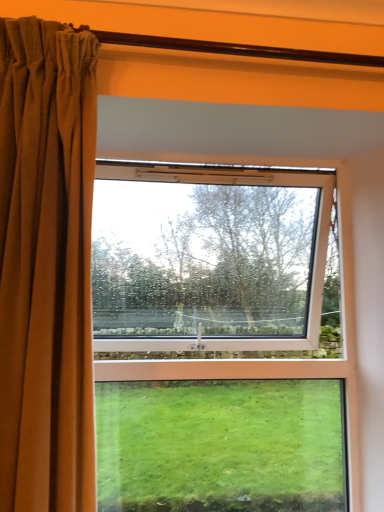
Where is `clear glass window at center`? Image resolution: width=384 pixels, height=512 pixels. clear glass window at center is located at coordinates (215, 341).

This screenshot has height=512, width=384. What do you see at coordinates (215, 341) in the screenshot? I see `clear glass window at center` at bounding box center [215, 341].

Where is `brown velvet curtain at left`? The width and height of the screenshot is (384, 512). brown velvet curtain at left is located at coordinates (46, 266).

Looking at this image, in order to face brown velvet curtain at left, should I rotate leftwards or rightwards?

Turn left approximately 18.799 degrees to face it.

Describe the element at coordinates (46, 266) in the screenshot. I see `brown velvet curtain at left` at that location.

Locate an element on the screen. The width and height of the screenshot is (384, 512). clear glass window at center is located at coordinates (215, 341).

Considering the positions of objects clear glass window at center and brown velvet curtain at left in the image provided, who is more to the left, clear glass window at center or brown velvet curtain at left?

brown velvet curtain at left is more to the left.

Is clear glass window at center closer to the viewer compared to brown velvet curtain at left?

No, it is behind brown velvet curtain at left.

Which is behind, point (270, 480) or point (8, 124)?

Positioned behind is point (270, 480).

From the image's perspective, would you say clear glass window at center is shown under brown velvet curtain at left?

Yes, from the image's perspective, clear glass window at center is below brown velvet curtain at left.

From a real-world perspective, who is located higher, clear glass window at center or brown velvet curtain at left?

brown velvet curtain at left, from a real-world perspective.

Between clear glass window at center and brown velvet curtain at left, which one has smaller width?

brown velvet curtain at left is thinner.

Which of these two, clear glass window at center or brown velvet curtain at left, stands shorter?

With less height is brown velvet curtain at left.

Considering the sizes of objects clear glass window at center and brown velvet curtain at left in the image provided, who is bigger, clear glass window at center or brown velvet curtain at left?

With larger size is clear glass window at center.

Is brown velvet curtain at left surrounded by clear glass window at center?

No.

Consider the image. Is the surface of clear glass window at center in direct contact with brown velvet curtain at left?

No, clear glass window at center is not in contact with brown velvet curtain at left.

Is clear glass window at center positioned with its back to brown velvet curtain at left?

That's not correct — clear glass window at center is not looking away from brown velvet curtain at left.

How far apart are clear glass window at center and brown velvet curtain at left?

They are 3.73 meters apart.

Locate an element on the screen. The image size is (384, 512). window located below the brown velvet curtain at left (from the image's perspective) is located at coordinates (215, 341).

Based on the photo, considering the positions of objects brown velvet curtain at left and clear glass window at center in the image provided, who is more to the left, brown velvet curtain at left or clear glass window at center?

Positioned to the left is brown velvet curtain at left.

Consider the image. Who is more distant, brown velvet curtain at left or clear glass window at center?

Positioned behind is clear glass window at center.

Which point is more forward, (74, 382) or (160, 425)?

The point (74, 382) is more forward.

Based on the photo, from the image's perspective, is brown velvet curtain at left under clear glass window at center?

Actually, brown velvet curtain at left appears above clear glass window at center in the image.

From a real-world perspective, is brown velvet curtain at left under clear glass window at center?

Incorrect, from a real-world perspective, brown velvet curtain at left is higher than clear glass window at center.

Can you confirm if brown velvet curtain at left is thinner than clear glass window at center?

Yes, brown velvet curtain at left is thinner than clear glass window at center.

Considering the sizes of brown velvet curtain at left and clear glass window at center in the image, is brown velvet curtain at left taller or shorter than clear glass window at center?

Clearly, brown velvet curtain at left is shorter compared to clear glass window at center.

In the scene shown: Between brown velvet curtain at left and clear glass window at center, which one has larger size?

With larger size is clear glass window at center.

Is brown velvet curtain at left surrounding clear glass window at center?

Definitely not — clear glass window at center is not inside brown velvet curtain at left.

Is brown velvet curtain at left far from clear glass window at center?

That's right, there is a large distance between brown velvet curtain at left and clear glass window at center.

Does brown velvet curtain at left turn towards clear glass window at center?

No, brown velvet curtain at left is not aimed at clear glass window at center.

How many degrees apart are the facing directions of brown velvet curtain at left and clear glass window at center?

brown velvet curtain at left and clear glass window at center are facing 3.48 degrees away from each other.

What are the coordinates of `window below the brown velvet curtain at left (from a real-world perspective)` in the screenshot? It's located at (215, 341).

I want to click on window below the brown velvet curtain at left (from the image's perspective), so click(215, 341).

Locate an element on the screen. window on the right of brown velvet curtain at left is located at coordinates (215, 341).